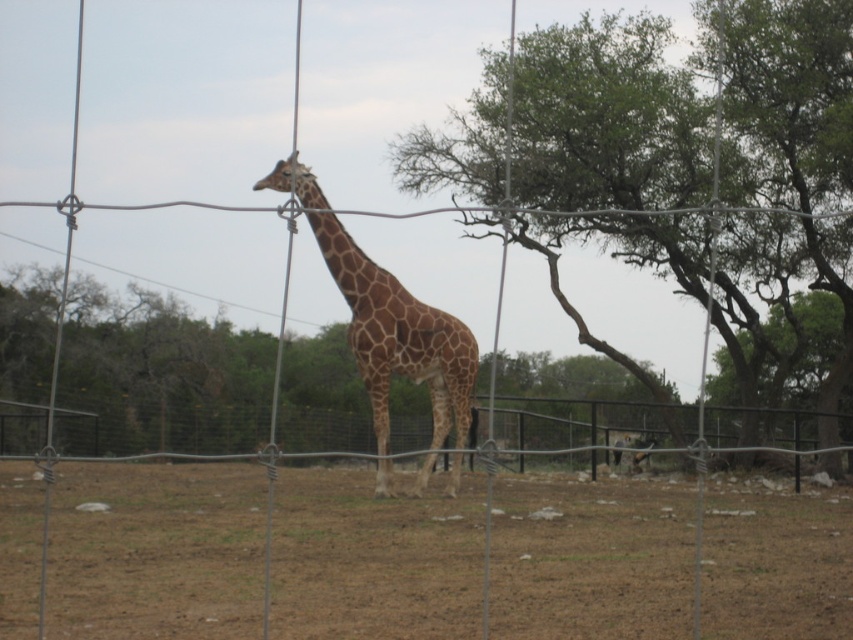
Which is in front, point (592, 490) or point (292, 412)?

Positioned in front is point (592, 490).

Does brown soil at center come behind wire mesh fence at center?

Yes, brown soil at center is behind wire mesh fence at center.

Who is more forward, (x=624, y=556) or (x=422, y=422)?

Point (x=624, y=556) is more forward.

Where is `brown soil at center`? brown soil at center is located at coordinates (155, 552).

Can you confirm if green leafy tree at center is shorter than wire mesh fence at center?

In fact, green leafy tree at center may be taller than wire mesh fence at center.

Can you confirm if green leafy tree at center is smaller than wire mesh fence at center?

Incorrect, green leafy tree at center is not smaller in size than wire mesh fence at center.

Describe the element at coordinates (607, 118) in the screenshot. The height and width of the screenshot is (640, 853). I see `green leafy tree at center` at that location.

The width and height of the screenshot is (853, 640). I want to click on green leafy tree at center, so click(607, 118).

Does green leafy tree at center have a lesser height compared to brown spotted giraffe at center?

Incorrect, green leafy tree at center's height does not fall short of brown spotted giraffe at center's.

Is green leafy tree at center below brown spotted giraffe at center?

Incorrect, green leafy tree at center is not positioned below brown spotted giraffe at center.

What do you see at coordinates (607, 118) in the screenshot?
I see `green leafy tree at center` at bounding box center [607, 118].

Image resolution: width=853 pixels, height=640 pixels. In order to click on green leafy tree at center in this screenshot , I will do `click(607, 118)`.